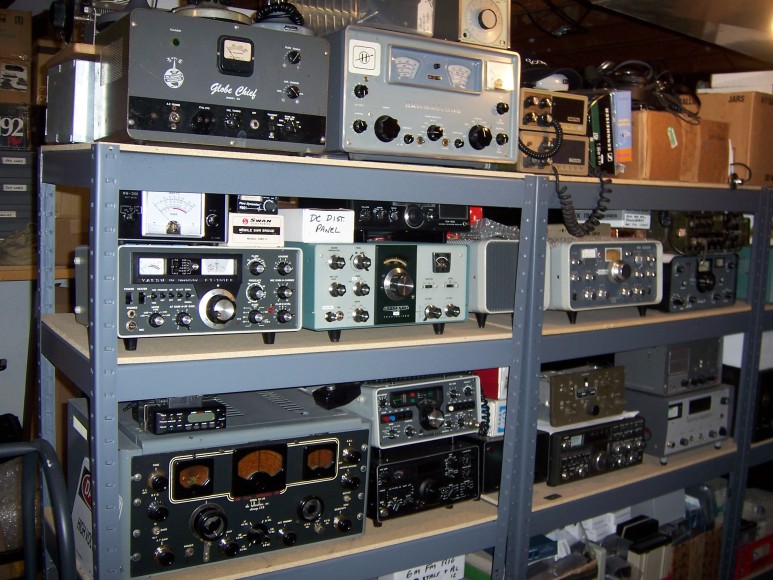
Point to any dc dist. panel box in the image. Your answer should be formatted as a list of tuples, i.e. [(x1, y1), (x2, y2), ...], where each tuple contains the x and y coordinates of a point satisfying the conditions above.

[(345, 231)]